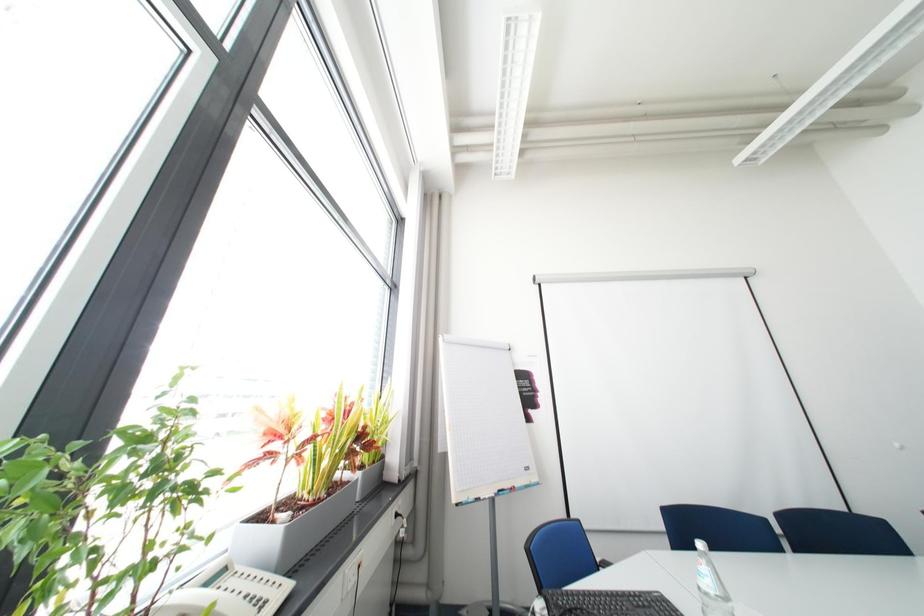
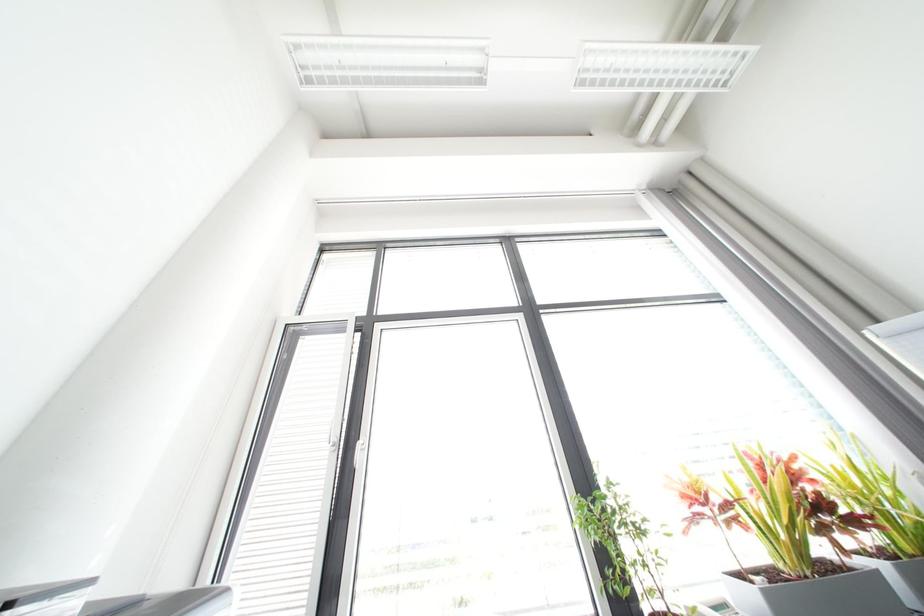
The first image is from the beginning of the video and the second image is from the end. How did the camera likely rotate when shooting the video?

The camera rotated toward left-up.